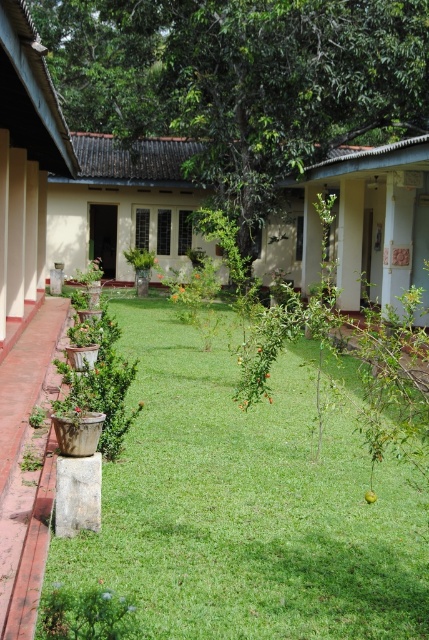
You are planning to place a small garden bench in the courtyard. The bench requires a space that is larger than the green grass at center but smaller than the green leafy tree at center. Is there a suitable area available in the courtyard for the bench?

The green grass at center has a smaller size compared to the green leafy tree at center, so the area between their sizes may be suitable for placing the bench. However, since the exact size of the bench isn t provided, it s recommended to measure the space between the green grass at center and the green leafy tree at center to ensure compatibility.

You are standing in the courtyard and want to know which object is taller between the green grass at center and the green leafy tree at center. Which one is taller?

The green leafy tree at center is taller than the green grass at center.